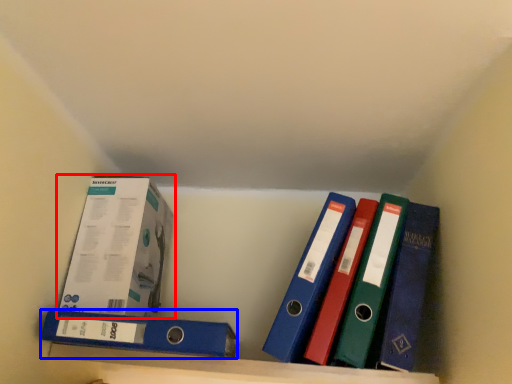
Question: Which point is further to the camera, box (highlighted by a red box) or binder (highlighted by a blue box)?

Choices:
 (A) box
 (B) binder

Answer: (A)